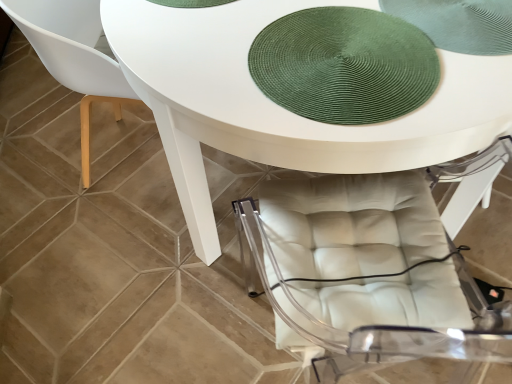
Locate an element on the screen. This screenshot has height=384, width=512. vacant space underneath matte white chair at lower left (from a real-world perspective) is located at coordinates pyautogui.click(x=128, y=165).